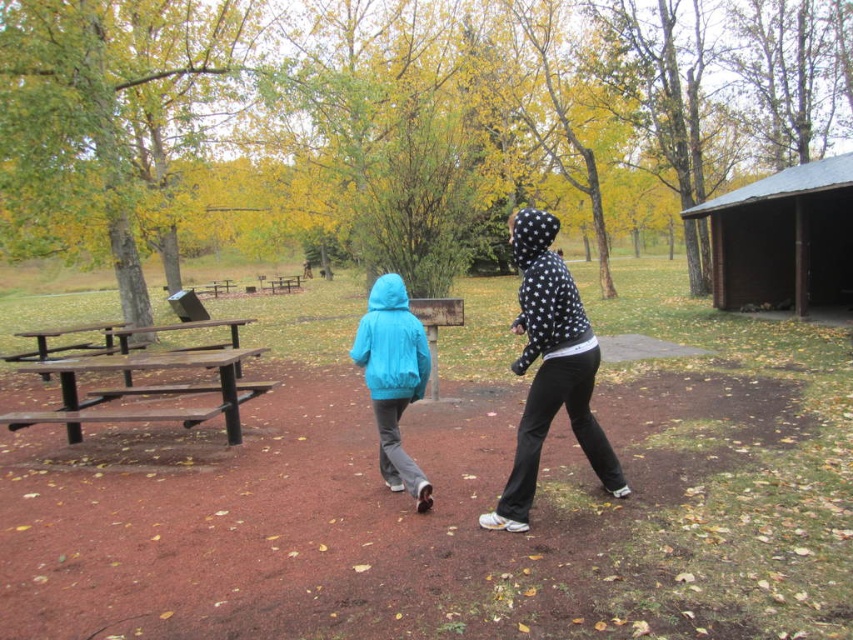
Is brown wooden shed at right positioned in front of polka dot hoodie at center?

No.

What do you see at coordinates (782, 237) in the screenshot? This screenshot has width=853, height=640. I see `brown wooden shed at right` at bounding box center [782, 237].

This screenshot has height=640, width=853. I want to click on brown wooden shed at right, so [782, 237].

Which is behind, point (554, 266) or point (413, 355)?

The point (413, 355) is behind.

Between polka dot hoodie at center and matte blue jacket at center, which one has more height?

Standing taller between the two is polka dot hoodie at center.

Which is in front, point (585, 378) or point (392, 422)?

Point (585, 378) is in front.

You are a GUI agent. You are given a task and a screenshot of the screen. Output one action in this format:
    pyautogui.click(x=<x>, y=<y>)
    Task: Click on the polka dot hoodie at center
    This screenshot has width=853, height=640.
    Given the screenshot: What is the action you would take?
    pyautogui.click(x=550, y=369)

Who is lower down, brown wooden shed at right or matte blue jacket at center?

matte blue jacket at center is lower down.

Who is more distant from viewer, (810,202) or (381,426)?

The point (810,202) is behind.

What do you see at coordinates (782, 237) in the screenshot?
I see `brown wooden shed at right` at bounding box center [782, 237].

I want to click on brown wooden shed at right, so click(782, 237).